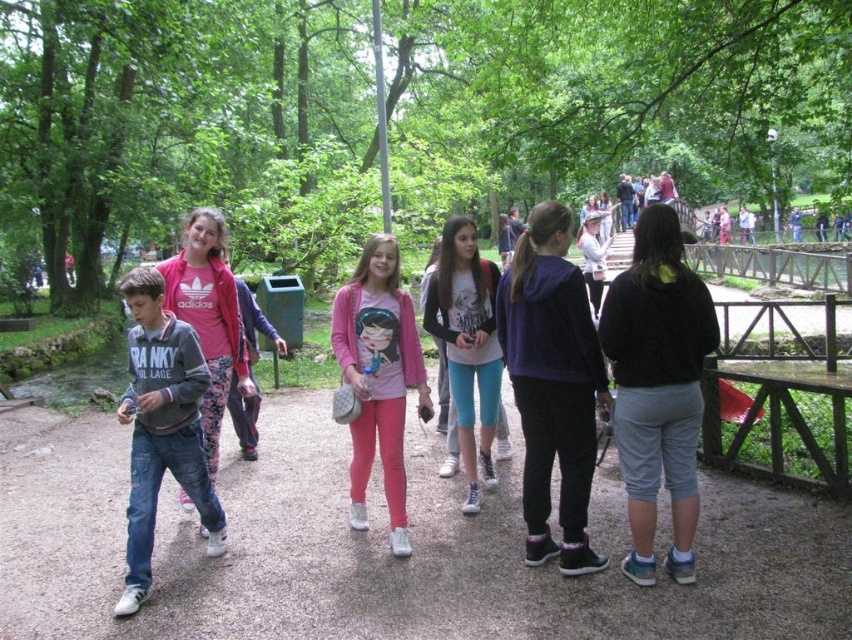
Can you confirm if dark gray hoodie at center is taller than purple fleece jacket at center?

Yes, dark gray hoodie at center is taller than purple fleece jacket at center.

Can you confirm if dark gray hoodie at center is positioned above purple fleece jacket at center?

Incorrect, dark gray hoodie at center is not positioned above purple fleece jacket at center.

Between point (678, 284) and point (574, 429), which one is positioned behind?

The point (574, 429) is behind.

The width and height of the screenshot is (852, 640). Find the location of `dark gray hoodie at center`. dark gray hoodie at center is located at coordinates (657, 387).

Is point (528, 241) positioned in front of point (459, 333)?

Yes, point (528, 241) is in front of point (459, 333).

What do you see at coordinates (551, 385) in the screenshot? The height and width of the screenshot is (640, 852). I see `purple fleece jacket at center` at bounding box center [551, 385].

I want to click on purple fleece jacket at center, so click(x=551, y=385).

Which of these two, pink matte leggings at center or teal leggings at center, stands taller?

teal leggings at center is taller.

Measure the distance between point (338, 317) and camera.

Point (338, 317) and camera are 15.88 feet apart from each other.

Is point (361, 396) behind point (491, 381)?

That is False.

What are the coordinates of `pink matte leggings at center` in the screenshot? It's located at (378, 378).